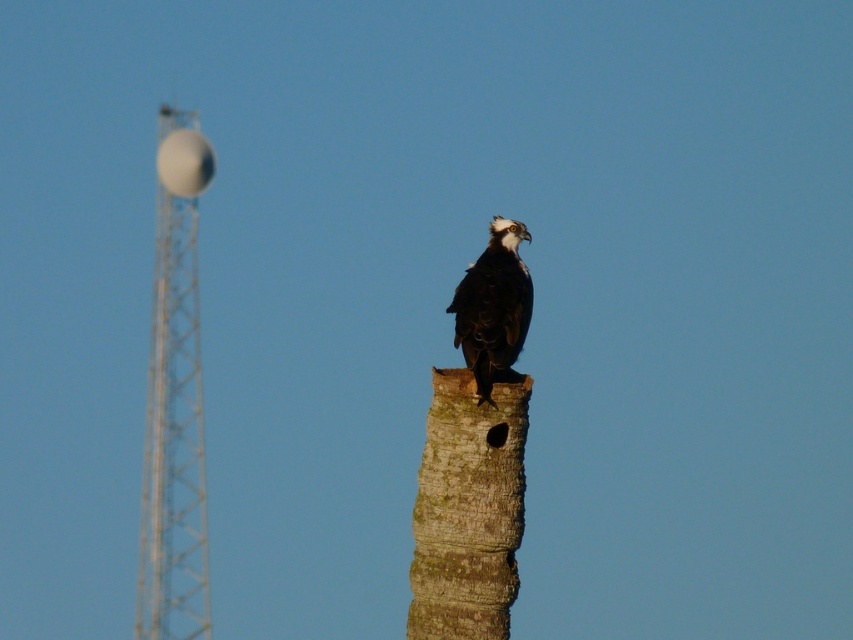
Can you confirm if white metallic tower at left is positioned to the right of dark brown feathers at center?

In fact, white metallic tower at left is to the left of dark brown feathers at center.

Measure the distance from white metallic tower at left to dark brown feathers at center.

white metallic tower at left is 106.67 meters from dark brown feathers at center.

Between point (181, 461) and point (492, 310), which one is positioned in front?

Point (492, 310) is more forward.

The width and height of the screenshot is (853, 640). I want to click on white metallic tower at left, so click(x=173, y=440).

Who is positioned more to the left, brown rough tree trunk at center or dark brown feathers at center?

Positioned to the left is brown rough tree trunk at center.

Is brown rough tree trunk at center bigger than dark brown feathers at center?

Yes, brown rough tree trunk at center is bigger than dark brown feathers at center.

At what (x,y) coordinates should I click in order to perform the action: click on brown rough tree trunk at center. Please return your answer as a coordinate pair (x, y). This screenshot has width=853, height=640. Looking at the image, I should click on coord(468,509).

I want to click on brown rough tree trunk at center, so click(468, 509).

Is point (434, 582) behind point (186, 451)?

No, (434, 582) is in front of (186, 451).

Is brown rough tree trunk at center wider than white metallic tower at left?

Incorrect, brown rough tree trunk at center's width does not surpass white metallic tower at left's.

Does point (450, 445) come behind point (154, 397)?

No, it is in front of (154, 397).

Locate an element on the screen. The width and height of the screenshot is (853, 640). brown rough tree trunk at center is located at coordinates (468, 509).